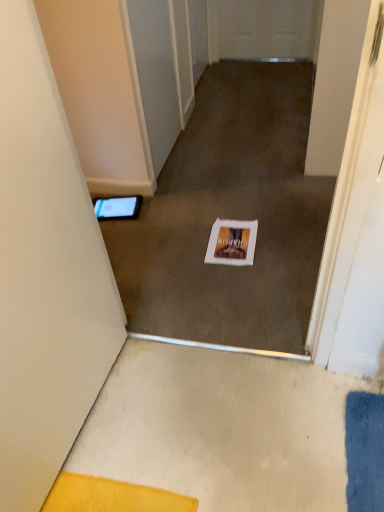
Question: Is white matte door at left thinner than white paper at center?

Choices:
 (A) no
 (B) yes

Answer: (B)

Question: Is white matte door at left smaller than white paper at center?

Choices:
 (A) no
 (B) yes

Answer: (A)

Question: From the image's perspective, is white matte door at left over white paper at center?

Choices:
 (A) yes
 (B) no

Answer: (B)

Question: Considering the relative positions of white matte door at left and white paper at center in the image provided, is white matte door at left behind white paper at center?

Choices:
 (A) yes
 (B) no

Answer: (B)

Question: Can you see white matte door at left touching white paper at center?

Choices:
 (A) yes
 (B) no

Answer: (B)

Question: Does point click(x=135, y=215) appear closer or farther from the camera than point click(x=228, y=260)?

Choices:
 (A) farther
 (B) closer

Answer: (A)

Question: From the image's perspective, is black glossy tablet at left positioned above or below white paper at center?

Choices:
 (A) above
 (B) below

Answer: (A)

Question: Considering the positions of black glossy tablet at left and white paper at center in the image, is black glossy tablet at left taller or shorter than white paper at center?

Choices:
 (A) short
 (B) tall

Answer: (B)

Question: Relative to white paper at center, is black glossy tablet at left in front or behind?

Choices:
 (A) front
 (B) behind

Answer: (B)

Question: Considering the positions of point (253, 254) and point (34, 135), is point (253, 254) closer or farther from the camera than point (34, 135)?

Choices:
 (A) closer
 (B) farther

Answer: (B)

Question: From the image's perspective, is white paper at center above or below white matte door at left?

Choices:
 (A) below
 (B) above

Answer: (B)

Question: From a real-world perspective, relative to white matte door at left, is white paper at center vertically above or below?

Choices:
 (A) below
 (B) above

Answer: (A)

Question: Would you say white paper at center is inside or outside white matte door at left?

Choices:
 (A) inside
 (B) outside

Answer: (B)

Question: Based on their positions, is white matte door at left located to the left or right of white paper at center?

Choices:
 (A) left
 (B) right

Answer: (A)

Question: Choose the correct answer: Is white matte door at left inside white paper at center or outside it?

Choices:
 (A) inside
 (B) outside

Answer: (B)